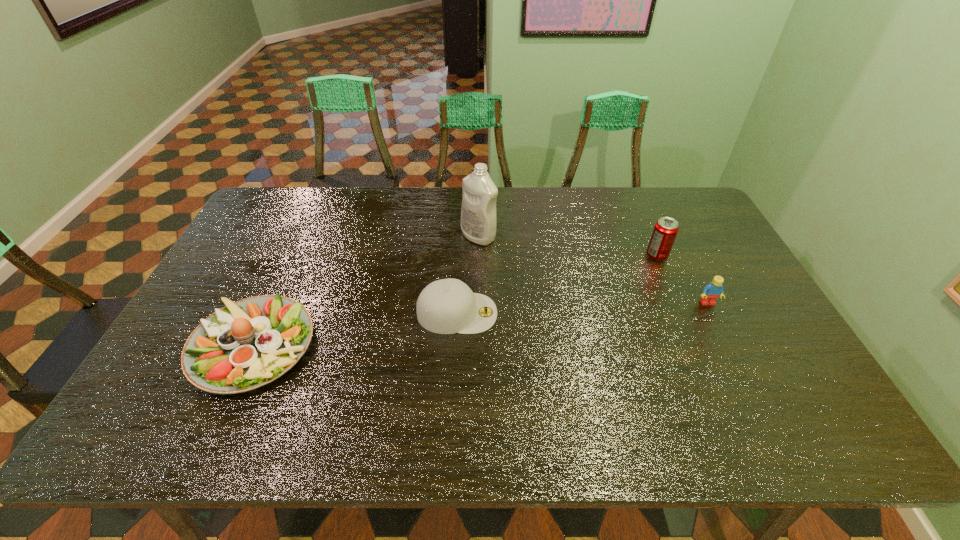
Where is `vacant space located on the back of the leftmost object`? This screenshot has height=540, width=960. vacant space located on the back of the leftmost object is located at coordinates (309, 223).

Locate an element on the screen. Image resolution: width=960 pixels, height=540 pixels. vacant region located on the front-facing side of the cap is located at coordinates (581, 313).

Identify the location of object present at the far edge. The image size is (960, 540). (478, 211).

Find the location of a particular element. Image resolution: width=960 pixels, height=540 pixels. object at the left edge is located at coordinates (249, 343).

The width and height of the screenshot is (960, 540). Find the location of `object present at the right edge`. object present at the right edge is located at coordinates (714, 289).

You are a GUI agent. You are given a task and a screenshot of the screen. Output one action in this format:
    pyautogui.click(x=<x>, y=<y>)
    Task: Click on the free space at the far edge of the desktop
    Image resolution: width=960 pixels, height=540 pixels.
    Given the screenshot: What is the action you would take?
    pyautogui.click(x=614, y=189)

Locate an element on the screen. The image size is (960, 540). vacant region at the near edge of the desktop is located at coordinates (499, 436).

This screenshot has height=540, width=960. In order to click on free spot at the left edge of the desktop in this screenshot , I will do 179,376.

Where is `vacant space at the right edge of the desktop`? vacant space at the right edge of the desktop is located at coordinates (744, 363).

Image resolution: width=960 pixels, height=540 pixels. In the image, there is a desktop. Find the location of `vacant space at the near left corner`. vacant space at the near left corner is located at coordinates (132, 429).